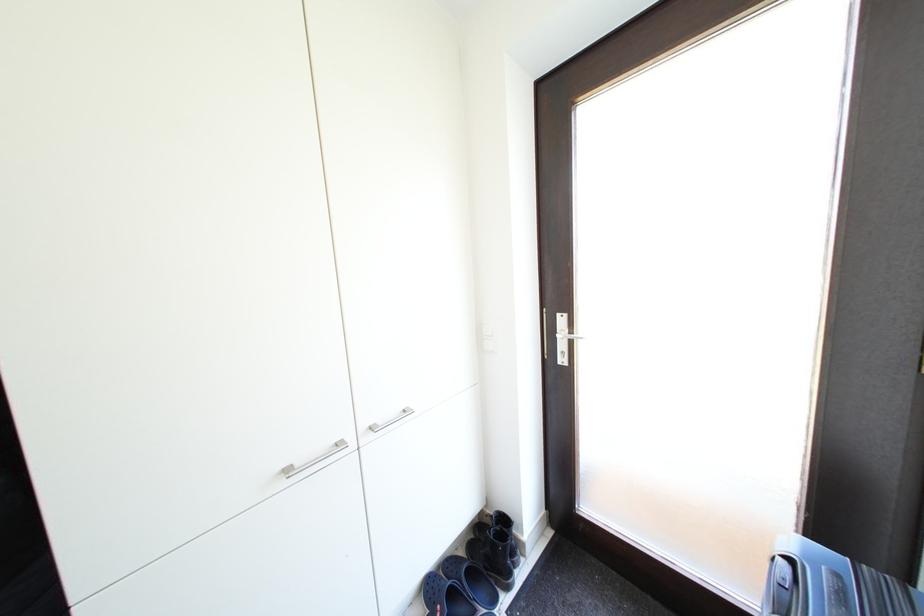
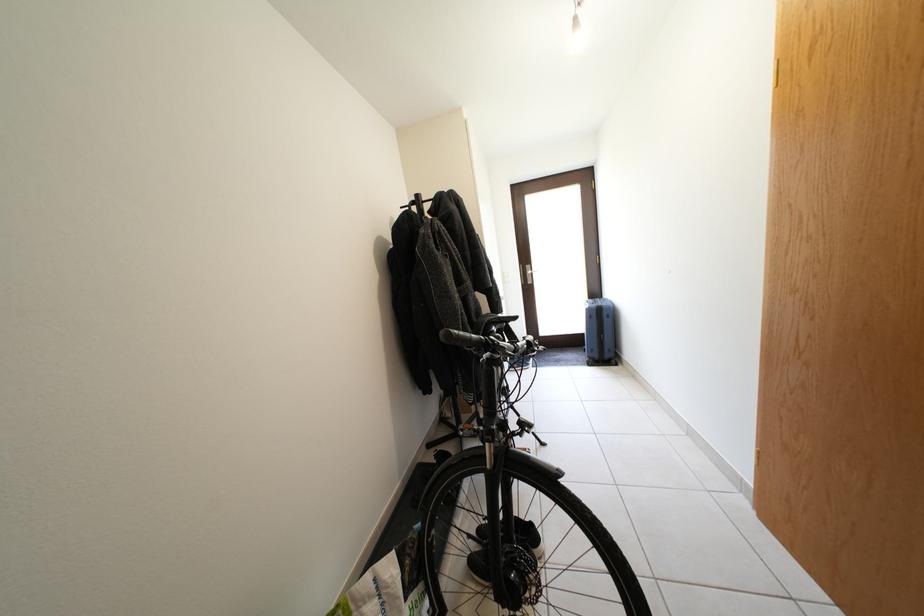
In a continuous first-person perspective shot, in which direction is the camera moving?

The movement direction of the cameraman is left, backward.